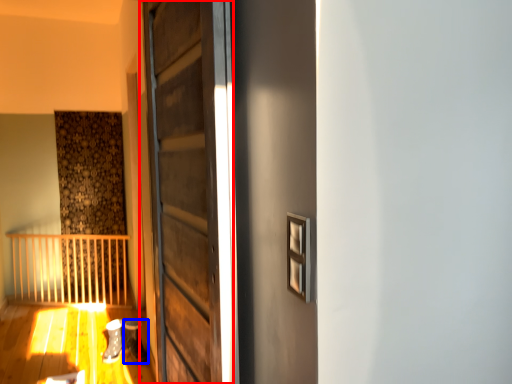
Question: Which object is further to the camera taking this photo, door (highlighted by a red box) or shoe (highlighted by a blue box)?

Choices:
 (A) door
 (B) shoe

Answer: (B)